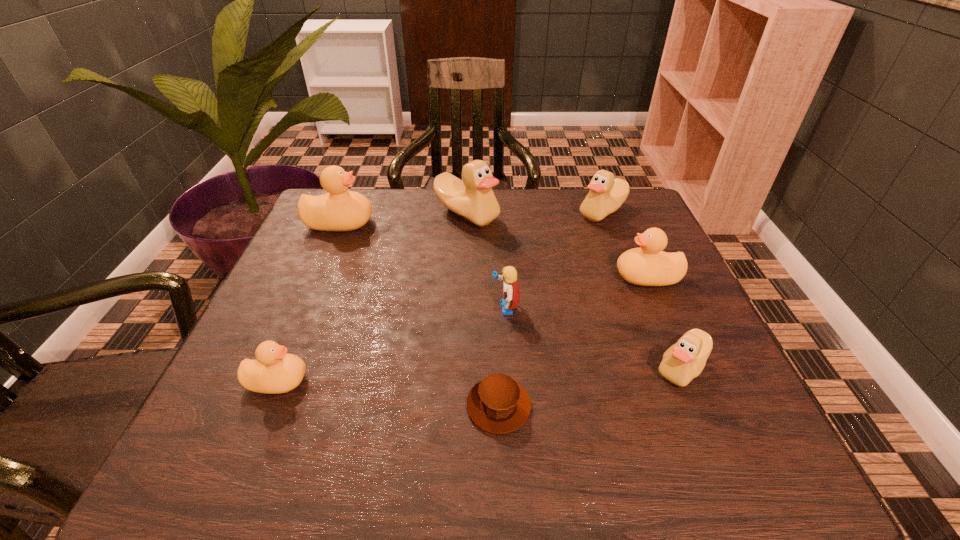
This screenshot has height=540, width=960. What are the coordinates of `vacant space that is in between the fourth duck from right to left and the farthest yellow duck` in the screenshot? It's located at (403, 219).

At what (x,y) coordinates should I click in order to perform the action: click on vacant region between the shortest object and the fifth farthest object. Please return your answer as a coordinate pair (x, y). The height and width of the screenshot is (540, 960). Looking at the image, I should click on (502, 357).

Locate an element on the screen. This screenshot has height=540, width=960. free point between the fifth farthest object and the leftmost beige duck is located at coordinates (486, 261).

Find the location of a particular element. The image size is (960, 540). free space between the third duck from left to right and the third nearest duck is located at coordinates (557, 246).

You are a GUI agent. You are given a task and a screenshot of the screen. Output one action in this format:
    pyautogui.click(x=<x>, y=<y>)
    Task: Click on the unoccupied position between the fourth nearest object and the second biggest beige duck
    This screenshot has width=960, height=540.
    Given the screenshot: What is the action you would take?
    pyautogui.click(x=554, y=260)

Find the location of a particular element. Image resolution: width=960 pixels, height=540 pixels. object that is the fourth nearest to the fourth farthest duck is located at coordinates pyautogui.click(x=472, y=198).

What are the coordinates of `object that is the sixth closest one to the shortest object` in the screenshot? It's located at (338, 210).

At what (x,y) coordinates should I click in order to perform the action: click on duck that is the nearest to the nearest beige duck. Please return your answer as a coordinate pair (x, y). Looking at the image, I should click on (647, 266).

Locate an element on the screen. This screenshot has width=960, height=540. duck that is the fifth closest to the smallest beige duck is located at coordinates (338, 210).

Choose which beige duck is the second nearest neighbor to the fourth duck from right to left. Please provide its 2D coordinates. Your answer should be formatted as a tuple, i.e. [(x, y)], where the tuple contains the x and y coordinates of a point satisfying the conditions above.

[(682, 362)]